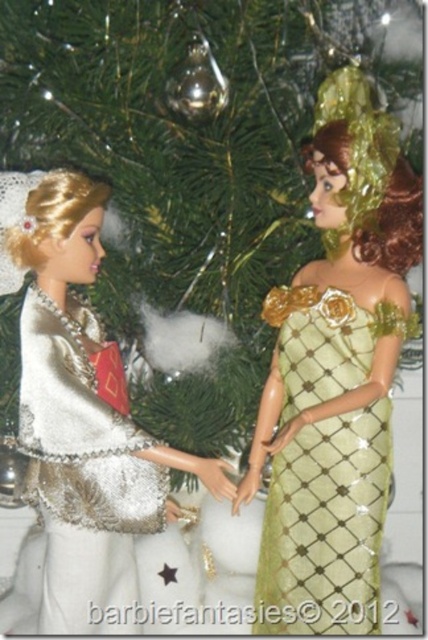
Question: Is gold sequined dress at center further to the viewer compared to white sequined dress at left?

Choices:
 (A) yes
 (B) no

Answer: (B)

Question: Is matte silver gown at left above white sequined dress at left?

Choices:
 (A) no
 (B) yes

Answer: (A)

Question: Which object is farther from the camera taking this photo?

Choices:
 (A) matte silver gown at left
 (B) gold sequined dress at center

Answer: (A)

Question: Does gold sequined dress at center appear over white sequined dress at left?

Choices:
 (A) no
 (B) yes

Answer: (A)

Question: Which point is farther from the camera taking this photo?

Choices:
 (A) (112, 428)
 (B) (71, 440)

Answer: (B)

Question: Which of the following is the farthest from the observer?

Choices:
 (A) white sequined dress at left
 (B) gold sequined dress at center

Answer: (A)